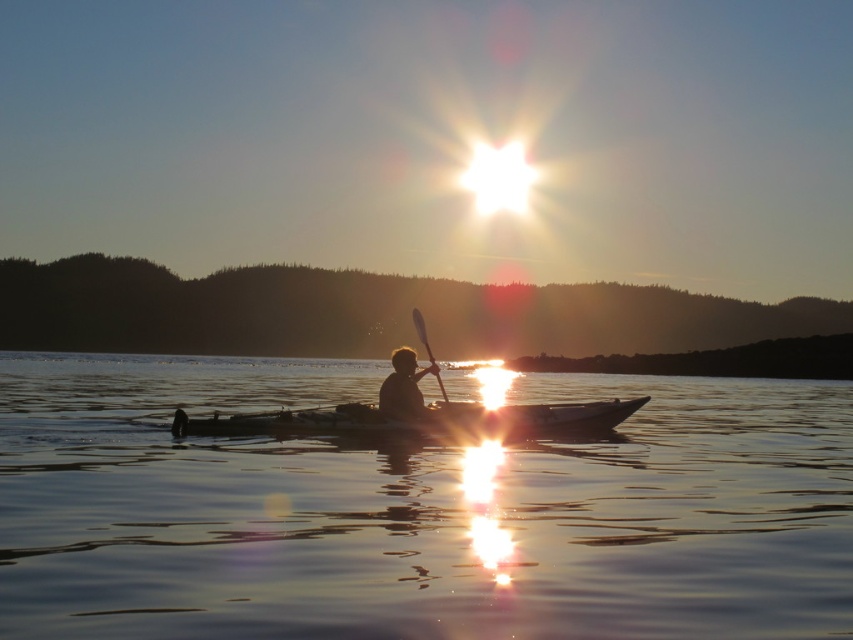
Does smooth skin person at center lie behind wooden smooth paddle at center?

That is False.

Is point (401, 369) farther from camera compared to point (421, 333)?

That is False.

Between point (425, 412) and point (438, 380), which one is positioned behind?

Point (425, 412)

This screenshot has width=853, height=640. I want to click on smooth skin person at center, so click(404, 387).

Is transparent water at center to the left of wooden smooth paddle at center from the viewer's perspective?

In fact, transparent water at center is to the right of wooden smooth paddle at center.

In the scene shown: Does transparent water at center lie in front of wooden smooth paddle at center?

Yes, transparent water at center is in front of wooden smooth paddle at center.

Locate an element on the screen. Image resolution: width=853 pixels, height=640 pixels. transparent water at center is located at coordinates (413, 509).

Locate an element on the screen. The image size is (853, 640). transparent water at center is located at coordinates (413, 509).

At what (x,y) coordinates should I click in order to perform the action: click on matte gray kayak at center. Please return your answer as a coordinate pair (x, y). This screenshot has width=853, height=640. Looking at the image, I should click on (421, 420).

Measure the distance from matte gray kayak at center to wooden smooth paddle at center.

3.29 meters

Image resolution: width=853 pixels, height=640 pixels. Identify the location of matte gray kayak at center. (421, 420).

The width and height of the screenshot is (853, 640). What are the coordinates of `matte gray kayak at center` in the screenshot? It's located at (421, 420).